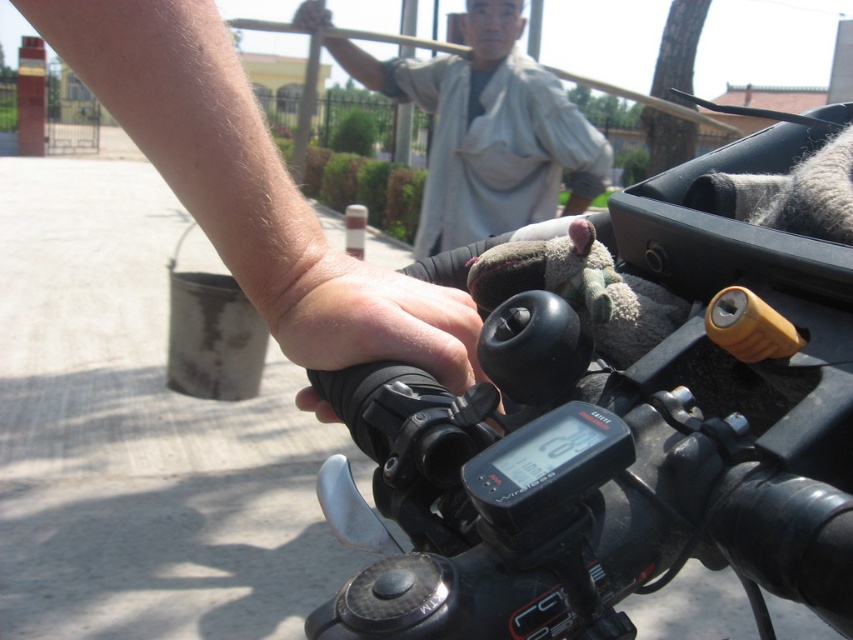
Between black rubber handlebar at center and dry skin at handle, which one is positioned lower?

black rubber handlebar at center is below.

Is black rubber handlebar at center wider than dry skin at handle?

Indeed, black rubber handlebar at center has a greater width compared to dry skin at handle.

Does point (834, 355) come in front of point (321, 294)?

Yes, point (834, 355) is closer to viewer.

In order to click on black rubber handlebar at center in this screenshot , I will do 621,416.

Image resolution: width=853 pixels, height=640 pixels. Identify the location of gray cotton shirt at upper center. (488, 131).

Between gray cotton shirt at upper center and dry skin at handle, which one has more height?

Standing taller between the two is gray cotton shirt at upper center.

Is point (552, 205) farther from camera compared to point (403, 337)?

Yes, it is.

Locate an element on the screen. The image size is (853, 640). gray cotton shirt at upper center is located at coordinates (488, 131).

Between smooth skin hand at center and dry skin at handle, which one has less height?

dry skin at handle

Who is taller, smooth skin hand at center or dry skin at handle?

Standing taller between the two is smooth skin hand at center.

The height and width of the screenshot is (640, 853). Describe the element at coordinates (250, 188) in the screenshot. I see `smooth skin hand at center` at that location.

Locate an element on the screen. smooth skin hand at center is located at coordinates (250, 188).